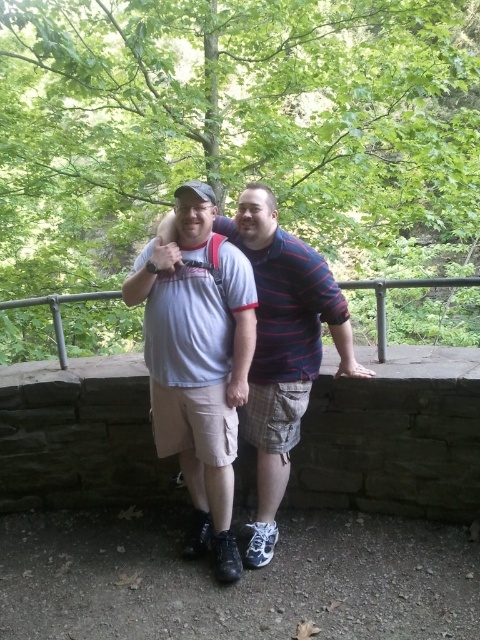
Is white cotton shirt at center wider than metal/rustic rail at center?

Yes, white cotton shirt at center is wider than metal/rustic rail at center.

Is point (253, 556) positioned before point (79, 298)?

Yes, it is in front of point (79, 298).

Locate an element on the screen. The height and width of the screenshot is (640, 480). white cotton shirt at center is located at coordinates (283, 348).